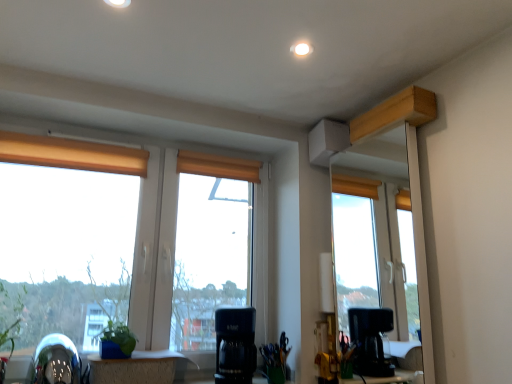
Question: Considering the relative positions of black plastic coffee maker at center and wooden table at lower center in the image provided, is black plastic coffee maker at center to the left or to the right of wooden table at lower center?

Choices:
 (A) left
 (B) right

Answer: (B)

Question: From a real-world perspective, is black plastic coffee maker at center physically located above or below wooden table at lower center?

Choices:
 (A) above
 (B) below

Answer: (A)

Question: Which of these objects is positioned closest to the shiny metallic swivel chair at lower left?

Choices:
 (A) green leafy plant at lower left
 (B) wooden table at lower center
 (C) matte wooden window at center
 (D) orange fabric curtain at upper left, the 2th curtain when ordered from right to left
 (E) orange fabric curtain at center, the 1th curtain from the right

Answer: (A)

Question: Considering the real-world distances, which object is farthest from the orange fabric curtain at upper left, the first curtain when ordered from left to right?

Choices:
 (A) wooden table at lower center
 (B) green leafy plant at lower left
 (C) matte wooden window at center
 (D) black plastic coffee maker at center
 (E) green matte plant at lower left

Answer: (D)